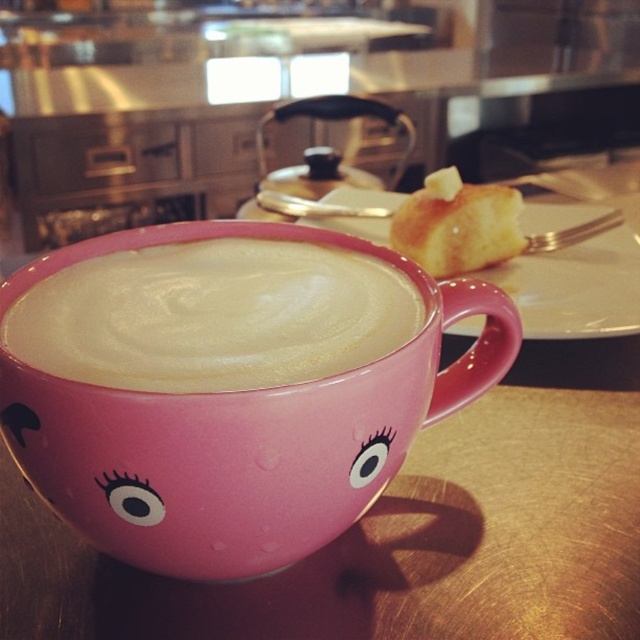
You are at a cafe and see two cups on the table. The pink glossy mug at center and the matte pink cup at center. Which one is positioned to the right?

A: The pink glossy mug at center is to the right of the matte pink cup at center.

You are a barista trying to place the pink glossy mug at center on a shelf that is 12 inches wide. Can the mug fit on the shelf if there is another object already occupying 0.5 inches of space on the shelf?

The pink glossy mug at center is 11.62 inches wide. Subtracting the 0.5 inches occupied by the other object, there is 11.5 inches remaining. Since the mug is slightly narrower than the remaining space, it can fit on the shelf.

You are looking at the scene from a distance. There are two points marked in the image. Which point is closer to you, point (234, 330) or point (476, 221)?

Point (234, 330) is in front of point (476, 221), so it is closer to you.